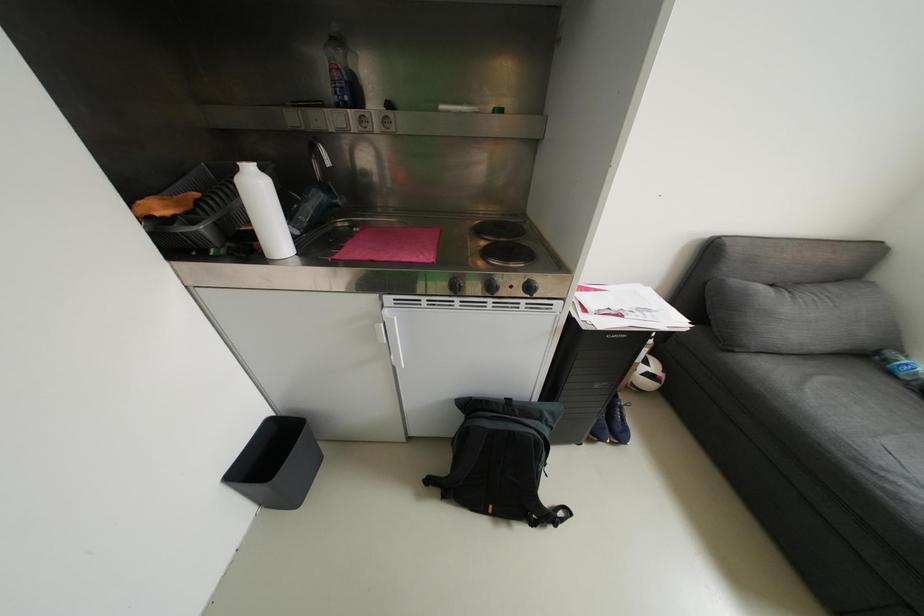
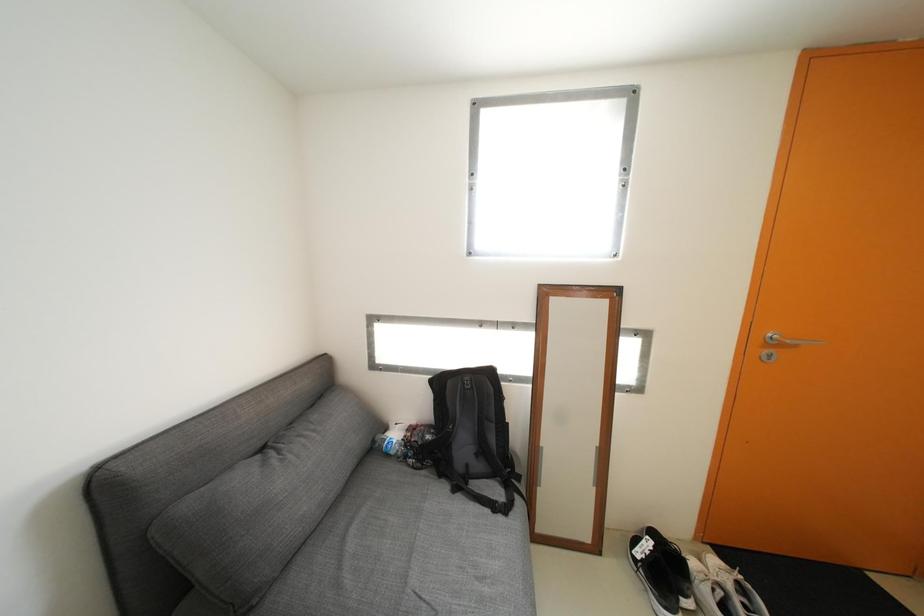
Question: The camera is either moving clockwise (left) or counter-clockwise (right) around the object. The first image is from the beginning of the video and the second image is from the end. Is the camera moving left or right when shooting the video?

Choices:
 (A) Left
 (B) Right

Answer: (A)